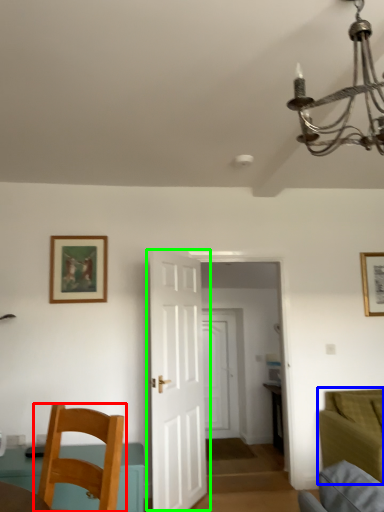
Question: Which object is positioned farthest from chair (highlighted by a red box)? Select from couch (highlighted by a blue box) and door (highlighted by a green box).

Choices:
 (A) couch
 (B) door

Answer: (A)